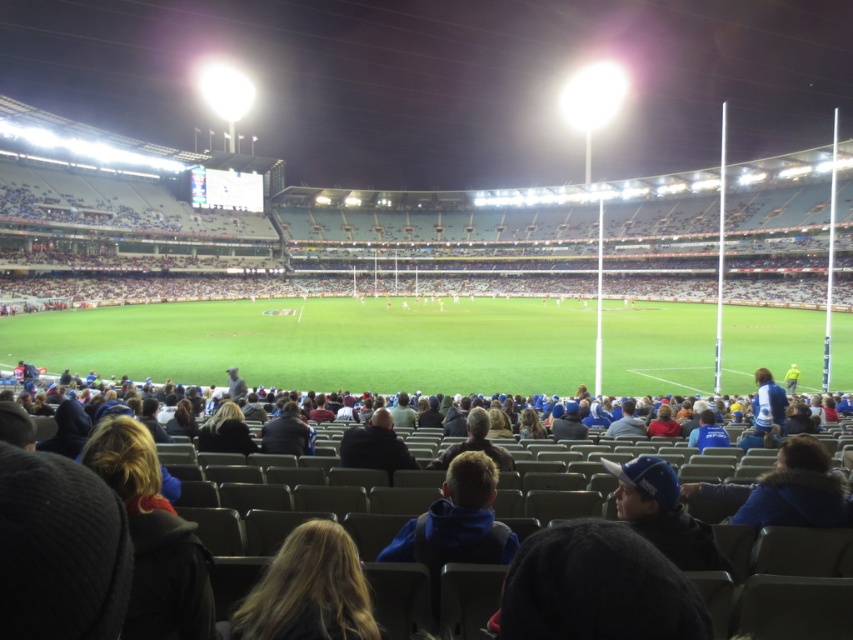
Question: Which object is closer to the camera taking this photo?

Choices:
 (A) dark gray jacket at center
 (B) dark brown leather jacket at center

Answer: (A)

Question: Among these objects, which one is nearest to the camera?

Choices:
 (A) dark gray jacket at center
 (B) dark brown leather jacket at center
 (C) dark blue jacket at center

Answer: (C)

Question: Considering the relative positions of dark blue jacket at center and blue fleece jacket at center in the image provided, where is dark blue jacket at center located with respect to blue fleece jacket at center?

Choices:
 (A) below
 (B) above

Answer: (A)

Question: Which object is farther from the camera taking this photo?

Choices:
 (A) dark brown leather jacket at center
 (B) dark blue jacket at center
 (C) blonde hair at lower center

Answer: (A)

Question: Can you confirm if blue fleece jacket at center is positioned below blue fabric cap at center?

Choices:
 (A) yes
 (B) no

Answer: (A)

Question: Can you confirm if dark blue jacket at center is wider than dark gray jacket at center?

Choices:
 (A) no
 (B) yes

Answer: (B)